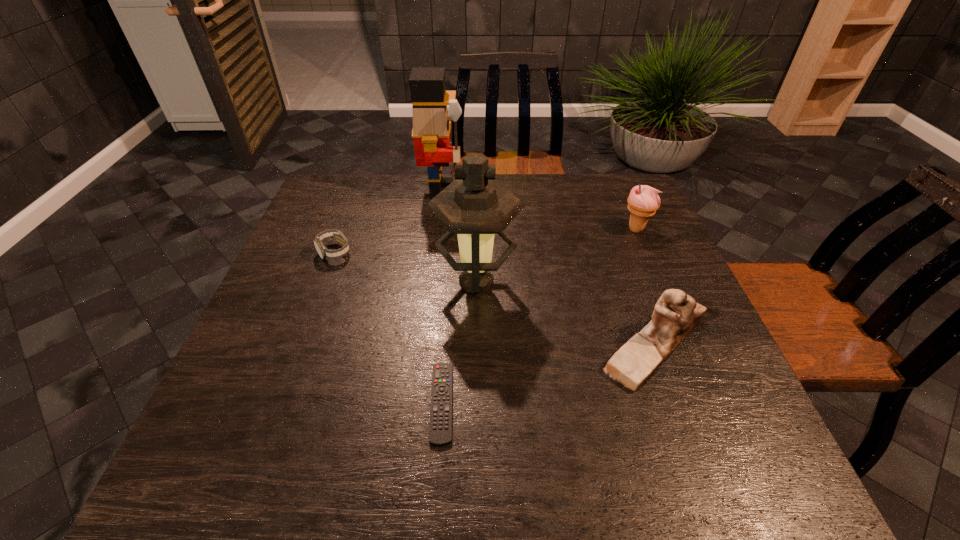
I want to click on vacant area in the image that satisfies the following two spatial constraints: 1. in front of the nutcracker holding the staff; 2. on the left side of the icecream, so click(438, 229).

Image resolution: width=960 pixels, height=540 pixels. What are the coordinates of `free location that satisfies the following two spatial constraints: 1. on the face of the watch; 2. on the left side of the oil lamp` in the screenshot? It's located at (324, 282).